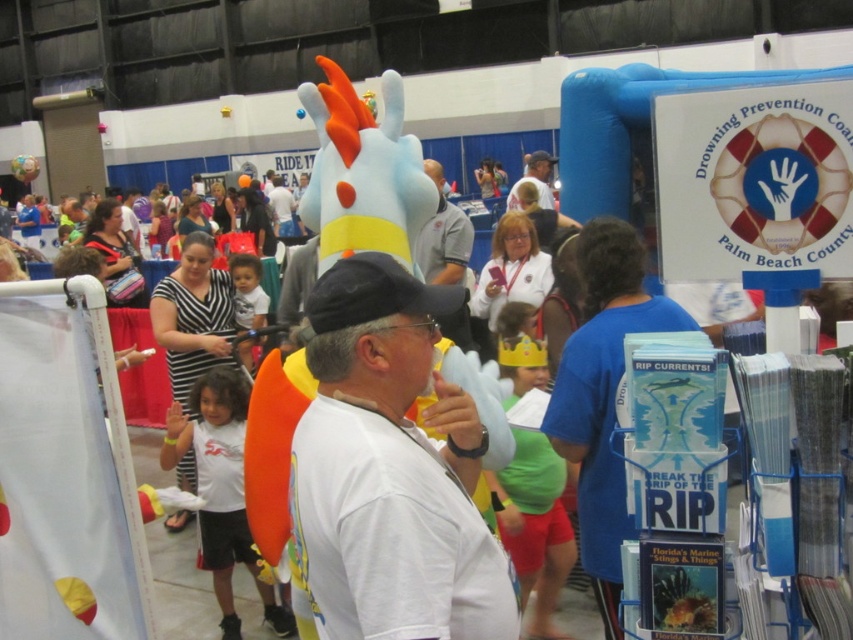
You are a safety officer at the event and need to ensure participants maintain a safe distance of at least 6 feet apart. You observe two people wearing the white matte shirt at center and the gray fabric shirt at center. Can you confirm if they are adhering to the social distancing guidelines?

The distance between the white matte shirt at center and the gray fabric shirt at center is 6.20 feet, which meets the required 6 feet apart. Therefore, they are adhering to the social distancing guidelines.

From the picture: You are a photographer at the event and need to capture a group photo of the two people wearing the white matte shirt at center and the gray fabric shirt at center. Which shirt should you focus on first to ensure they are in frame?

The white matte shirt at center is smaller than the gray fabric shirt at center, so you should focus on the gray fabric shirt at center first to ensure both are in frame.

You are a photographer at the event and need to capture a photo of both the white matte shirt at center and the gray fabric shirt at center in the same frame. Which shirt should you focus on first to ensure both are in the frame?

The white matte shirt at center has a lesser height compared to the gray fabric shirt at center, so you should focus on the gray fabric shirt at center first to ensure both are in the frame.